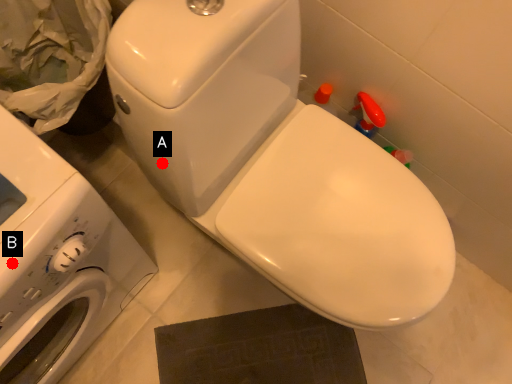
Question: Two points are circled on the image, labeled by A and B beside each circle. Which of the following is the farthest from the observer?

Choices:
 (A) A is further
 (B) B is further

Answer: (A)